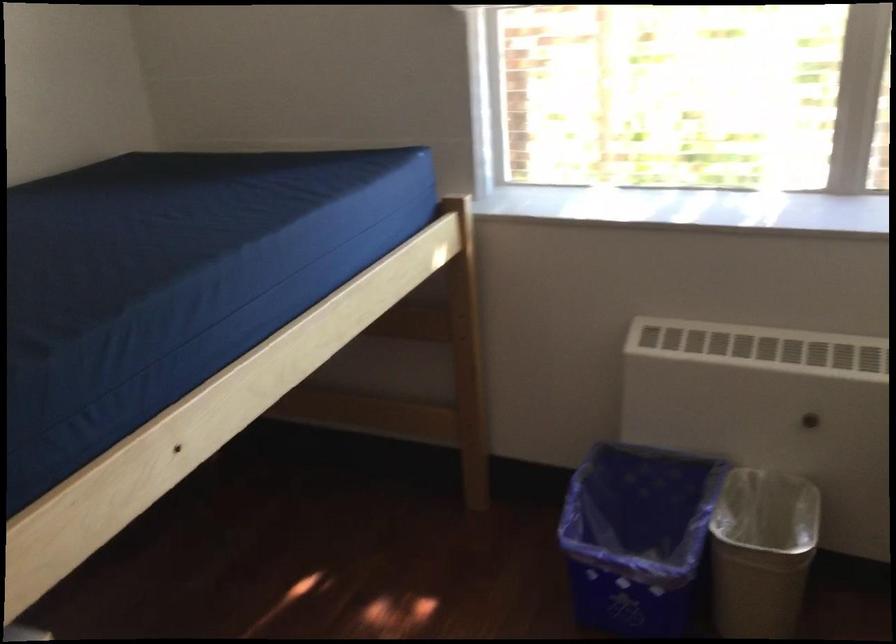
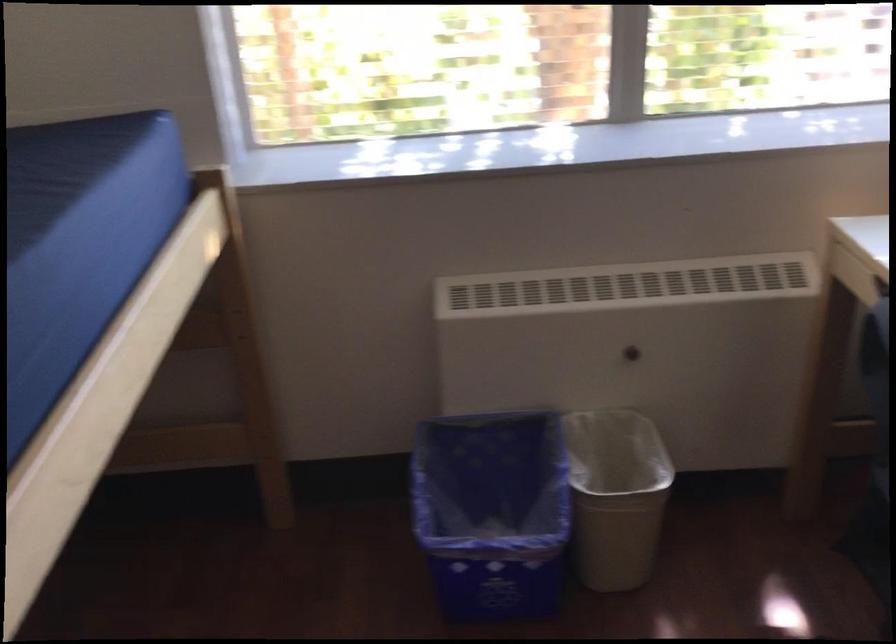
Locate, in the second image, the point that corresponds to point 746,547 in the first image.

(616, 496)